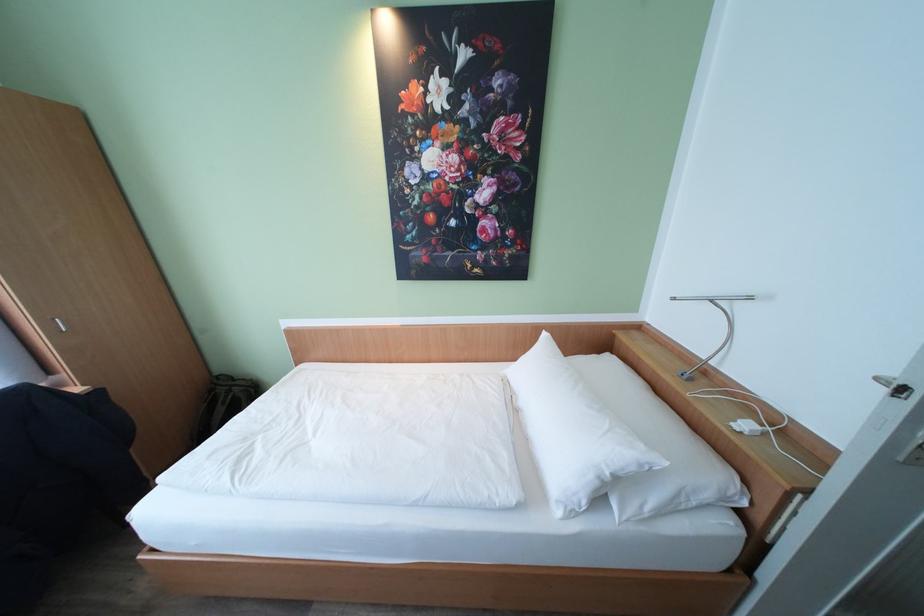
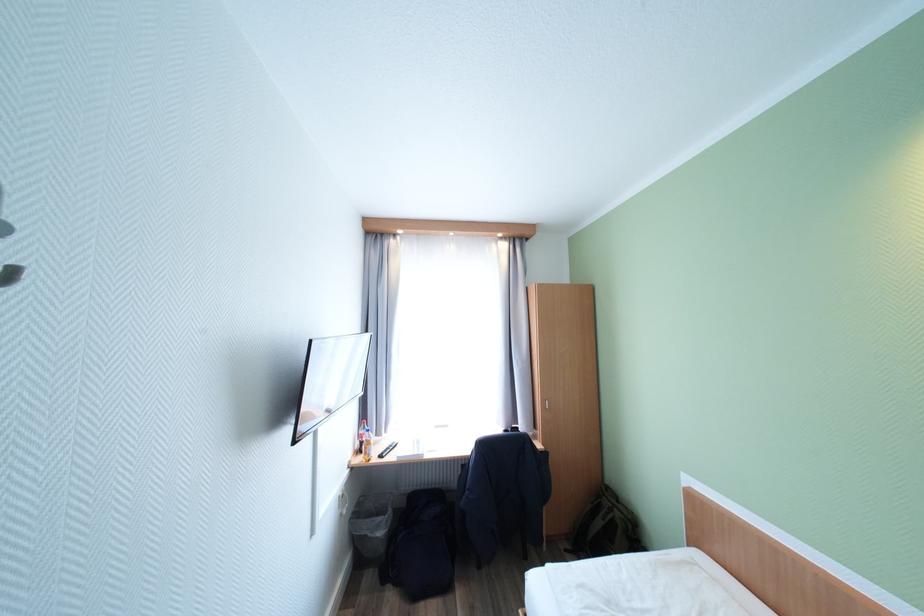
In the second image, find the point that corresponds to point 235,389 in the first image.

(617, 506)